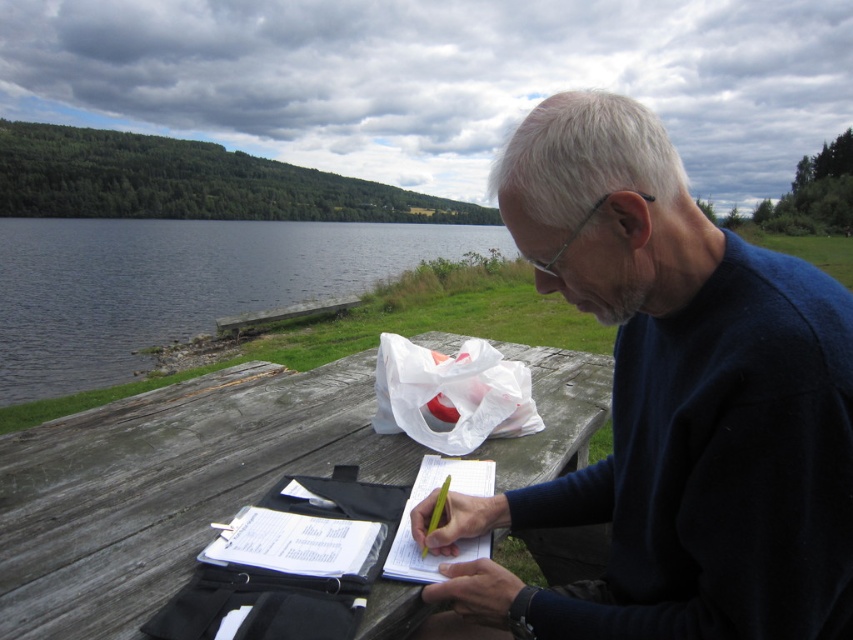
Does weathered wood picnic table at center have a lesser height compared to smooth water at left?

Yes.

Which of these two, weathered wood picnic table at center or smooth water at left, stands taller?

With more height is smooth water at left.

I want to click on weathered wood picnic table at center, so click(165, 486).

Is dark blue sweater at center shorter than smooth water at left?

Yes, dark blue sweater at center is shorter than smooth water at left.

Between dark blue sweater at center and smooth water at left, which one appears on the right side from the viewer's perspective?

From the viewer's perspective, dark blue sweater at center appears more on the right side.

Between point (714, 552) and point (271, 292), which one is positioned behind?

Point (271, 292)

Locate an element on the screen. dark blue sweater at center is located at coordinates (672, 404).

Is dark blue sweater at center taller than weathered wood picnic table at center?

Yes.

Find the location of a particular element. The width and height of the screenshot is (853, 640). dark blue sweater at center is located at coordinates (672, 404).

Find the location of a particular element. This screenshot has height=640, width=853. dark blue sweater at center is located at coordinates (672, 404).